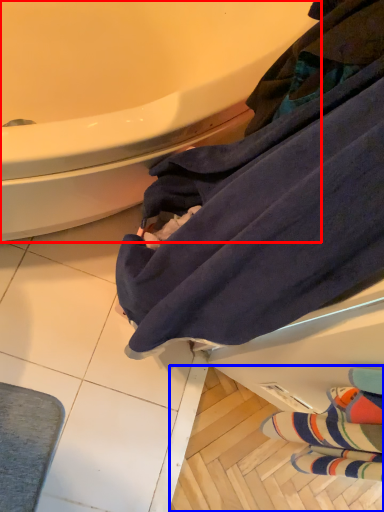
Question: Which object is closer to the camera taking this photo, bathtub (highlighted by a red box) or tile (highlighted by a blue box)?

Choices:
 (A) bathtub
 (B) tile

Answer: (A)